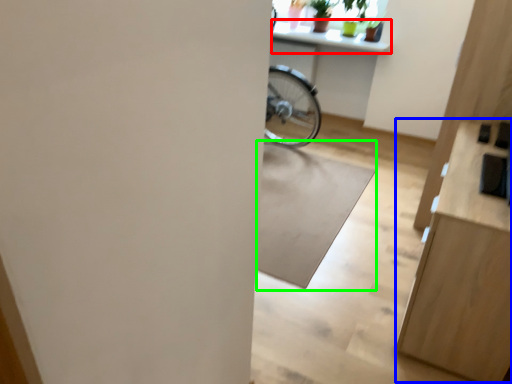
Question: Which object is the farthest from counter top (highlighted by a red box)? Choose among these: dresser (highlighted by a blue box) or mat (highlighted by a green box).

Choices:
 (A) dresser
 (B) mat

Answer: (A)